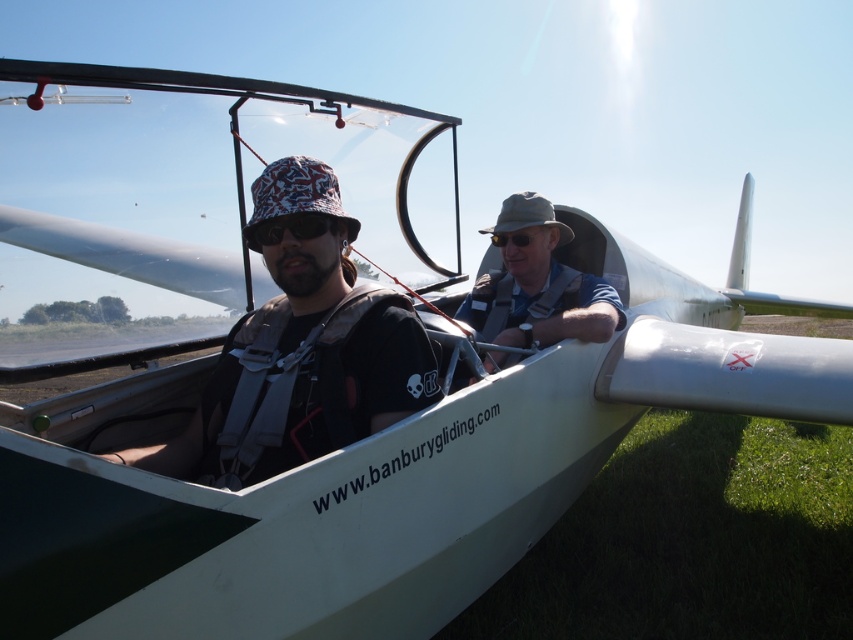
You are a photographer standing in front of the glider aircraft. You notice two points marked on the glider. The first point is at coordinates point (554, 284) and the second is at point (248, 228). Which point is closer to your camera?

Point (248, 228) is closer to the camera because it is less further than point (554, 284).

You are a photographer standing at the back of the glider aircraft. You want to take a photo of the light brown fabric hat at center. Where should you aim your camera?

You should aim your camera at point 0.450 on the horizontal axis and 0.632 on the vertical axis to capture the light brown fabric hat at center.